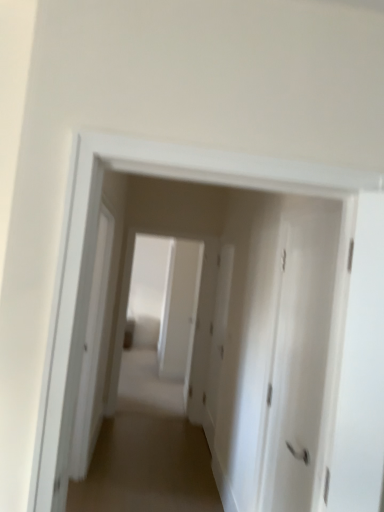
Question: Is the surface of white matte door at center, placed as the first door when sorted from front to back, in direct contact with brown carpet at center?

Choices:
 (A) yes
 (B) no

Answer: (B)

Question: Can you confirm if white matte door at center, which is the 2th door in back-to-front order, is shorter than brown carpet at center?

Choices:
 (A) no
 (B) yes

Answer: (A)

Question: Is white matte door at center, placed as the first door when sorted from front to back, closer to camera compared to brown carpet at center?

Choices:
 (A) no
 (B) yes

Answer: (B)

Question: From a real-world perspective, does white matte door at center, which is the 2th door in back-to-front order, sit lower than brown carpet at center?

Choices:
 (A) no
 (B) yes

Answer: (A)

Question: Considering the relative positions of white matte door at center, which is the 2th door in back-to-front order, and brown carpet at center in the image provided, is white matte door at center, which is the 2th door in back-to-front order, to the right of brown carpet at center from the viewer's perspective?

Choices:
 (A) yes
 (B) no

Answer: (A)

Question: From the image's perspective, is brown carpet at center positioned above or below white matte door at center, which is the 2th door in back-to-front order?

Choices:
 (A) above
 (B) below

Answer: (B)

Question: Does point (120, 403) appear closer or farther from the camera than point (278, 335)?

Choices:
 (A) closer
 (B) farther

Answer: (B)

Question: In terms of size, does brown carpet at center appear bigger or smaller than white matte door at center, placed as the first door when sorted from front to back?

Choices:
 (A) big
 (B) small

Answer: (A)

Question: Is brown carpet at center inside or outside of white matte door at center, which is the 2th door in back-to-front order?

Choices:
 (A) inside
 (B) outside

Answer: (B)

Question: Looking at the image, does white matte door at center, the second door when ordered from front to back, seem bigger or smaller compared to brown carpet at center?

Choices:
 (A) big
 (B) small

Answer: (B)

Question: Is point (221, 248) positioned closer to the camera than point (155, 483)?

Choices:
 (A) closer
 (B) farther

Answer: (B)

Question: In terms of width, does white matte door at center, placed as the first door when sorted from back to front, look wider or thinner when compared to brown carpet at center?

Choices:
 (A) thin
 (B) wide

Answer: (A)

Question: Considering the relative positions of white matte door at center, the second door when ordered from front to back, and brown carpet at center in the image provided, is white matte door at center, the second door when ordered from front to back, to the left or to the right of brown carpet at center?

Choices:
 (A) right
 (B) left

Answer: (A)

Question: Is brown carpet at center in front of or behind white matte door at center, the second door when ordered from front to back, in the image?

Choices:
 (A) behind
 (B) front

Answer: (B)

Question: In the image, is brown carpet at center on the left side or the right side of white matte door at center, placed as the first door when sorted from back to front?

Choices:
 (A) right
 (B) left

Answer: (B)